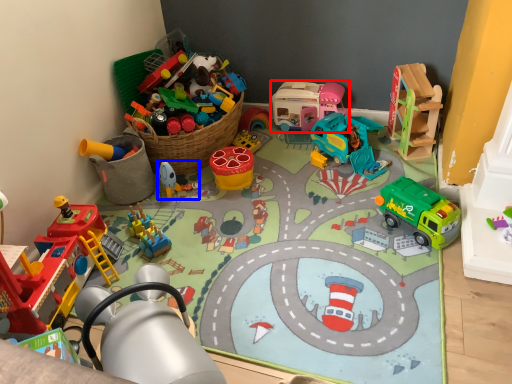
Question: Which of the following is the farthest to the observer, toy (highlighted by a red box) or toy (highlighted by a blue box)?

Choices:
 (A) toy
 (B) toy

Answer: (A)